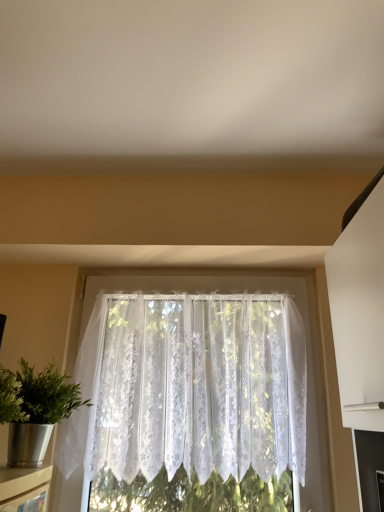
Question: Is white lace curtain at center thinner than metallic silver shelf at lower left?

Choices:
 (A) yes
 (B) no

Answer: (B)

Question: Are white lace curtain at center and metallic silver shelf at lower left located far from each other?

Choices:
 (A) yes
 (B) no

Answer: (B)

Question: From the image's perspective, would you say white lace curtain at center is shown under metallic silver shelf at lower left?

Choices:
 (A) no
 (B) yes

Answer: (A)

Question: Is white lace curtain at center turned away from metallic silver shelf at lower left?

Choices:
 (A) yes
 (B) no

Answer: (B)

Question: Can you confirm if white lace curtain at center is smaller than metallic silver shelf at lower left?

Choices:
 (A) no
 (B) yes

Answer: (A)

Question: Can you confirm if white lace curtain at center is positioned to the right of metallic silver shelf at lower left?

Choices:
 (A) yes
 (B) no

Answer: (A)

Question: Considering the relative positions of metallic silver shelf at lower left and metallic silver houseplant at left in the image provided, is metallic silver shelf at lower left behind metallic silver houseplant at left?

Choices:
 (A) no
 (B) yes

Answer: (A)

Question: Can you confirm if metallic silver shelf at lower left is smaller than metallic silver houseplant at left?

Choices:
 (A) yes
 (B) no

Answer: (A)

Question: Is metallic silver shelf at lower left bigger than metallic silver houseplant at left?

Choices:
 (A) yes
 (B) no

Answer: (B)

Question: Is metallic silver shelf at lower left outside metallic silver houseplant at left?

Choices:
 (A) no
 (B) yes

Answer: (B)

Question: Is metallic silver shelf at lower left looking in the opposite direction of metallic silver houseplant at left?

Choices:
 (A) no
 (B) yes

Answer: (A)

Question: From the image's perspective, would you say metallic silver shelf at lower left is shown under metallic silver houseplant at left?

Choices:
 (A) no
 (B) yes

Answer: (B)

Question: From a real-world perspective, is metallic silver houseplant at left located beneath white lace curtain at center?

Choices:
 (A) no
 (B) yes

Answer: (B)